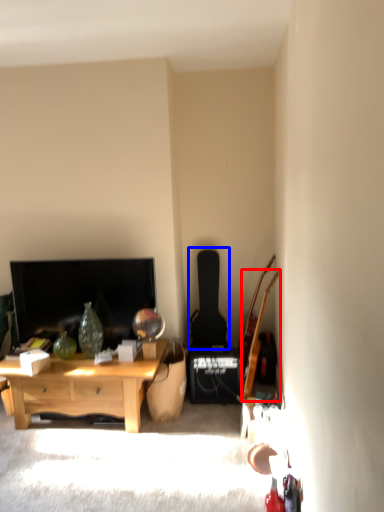
Question: Which object is further to the camera taking this photo, guitar (highlighted by a red box) or guitar (highlighted by a blue box)?

Choices:
 (A) guitar
 (B) guitar

Answer: (B)